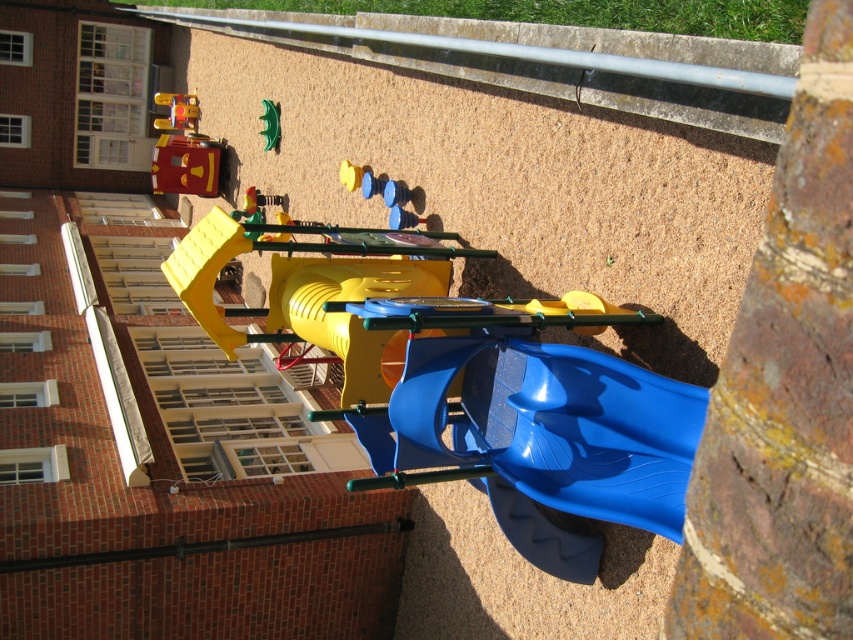
You are a child at the playground. You see the metallic yellow fire truck at upper left and the green rubber toy at center. Which object is higher up in the image?

The metallic yellow fire truck at upper left is above the green rubber toy at center, so it is higher up in the image.